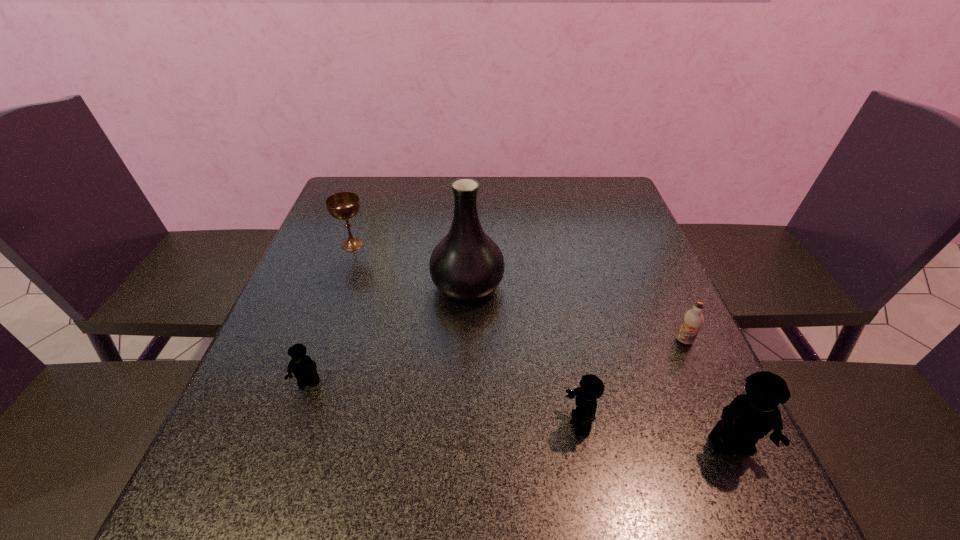
Where is `free space located on the front-facing side of the third object from right to left`? free space located on the front-facing side of the third object from right to left is located at coordinates (479, 423).

The image size is (960, 540). Find the location of `blank space located on the front-facing side of the third object from right to left`. blank space located on the front-facing side of the third object from right to left is located at coordinates (x=428, y=423).

This screenshot has width=960, height=540. What are the coordinates of `vacant space situated 0.390m on the front-facing side of the third object from right to left` in the screenshot? It's located at (343, 423).

Locate an element on the screen. The image size is (960, 540). blank space located 0.070m on the front of the chalice is located at coordinates (343, 271).

Where is `vacant region located on the left of the tallest object`? The width and height of the screenshot is (960, 540). vacant region located on the left of the tallest object is located at coordinates (309, 285).

This screenshot has width=960, height=540. In order to click on vacant region located 0.110m on the front of the fourth nearest object in this screenshot , I will do tap(708, 394).

This screenshot has height=540, width=960. I want to click on Lego that is at the left edge, so click(x=304, y=369).

This screenshot has width=960, height=540. I want to click on chalice that is at the left edge, so click(x=344, y=205).

Identify the location of Lego positioned at the right edge. (750, 416).

In order to click on chocolate milk that is at the right edge in this screenshot , I will do `click(693, 320)`.